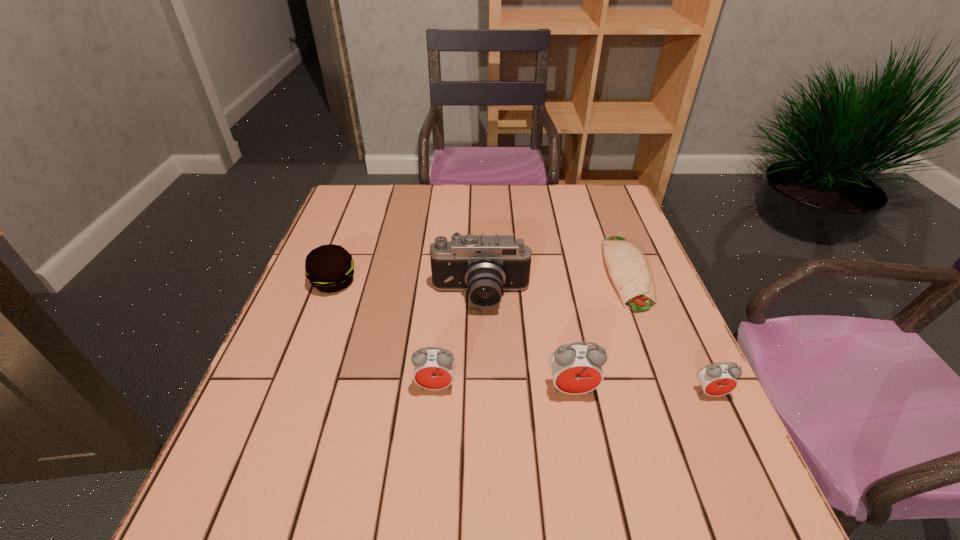
Image resolution: width=960 pixels, height=540 pixels. In order to click on the second tallest alarm clock in this screenshot , I will do `click(434, 368)`.

This screenshot has width=960, height=540. Find the location of `the leftmost alarm clock`. the leftmost alarm clock is located at coordinates (434, 368).

Where is `the second alarm clock from left to right`? the second alarm clock from left to right is located at coordinates (576, 368).

This screenshot has width=960, height=540. I want to click on the tallest alarm clock, so pyautogui.click(x=576, y=368).

What are the coordinates of `the rightmost alarm clock` in the screenshot? It's located at (718, 379).

Where is `the shortest object`? This screenshot has width=960, height=540. the shortest object is located at coordinates (628, 267).

You are a GUI agent. You are given a task and a screenshot of the screen. Output one action in this format:
    pyautogui.click(x=<x>, y=<y>)
    Task: Click on the camera
    
    Given the screenshot: What is the action you would take?
    pyautogui.click(x=484, y=265)

The width and height of the screenshot is (960, 540). What are the coordinates of `the leftmost object` in the screenshot? It's located at (329, 268).

You are a GUI agent. You are given a task and a screenshot of the screen. Output one action in this format:
    pyautogui.click(x=<x>, y=<y>)
    Task: Click on the vacant space located on the face of the leftmost alarm clock
    The image size is (960, 540).
    Given the screenshot: What is the action you would take?
    pyautogui.click(x=433, y=419)

Where is `blank space located on the face of the tallest alarm clock`? This screenshot has height=540, width=960. blank space located on the face of the tallest alarm clock is located at coordinates (585, 456).